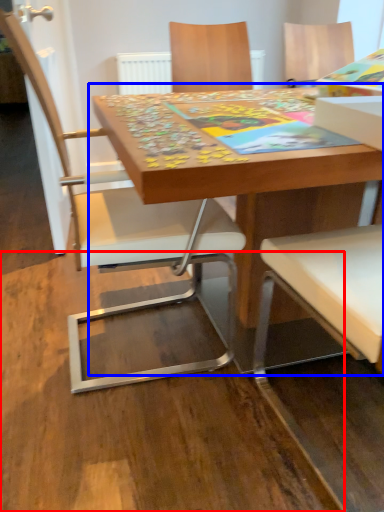
Question: Which of the following is the farthest to the observer, plywood (highlighted by a red box) or table (highlighted by a blue box)?

Choices:
 (A) plywood
 (B) table

Answer: (B)